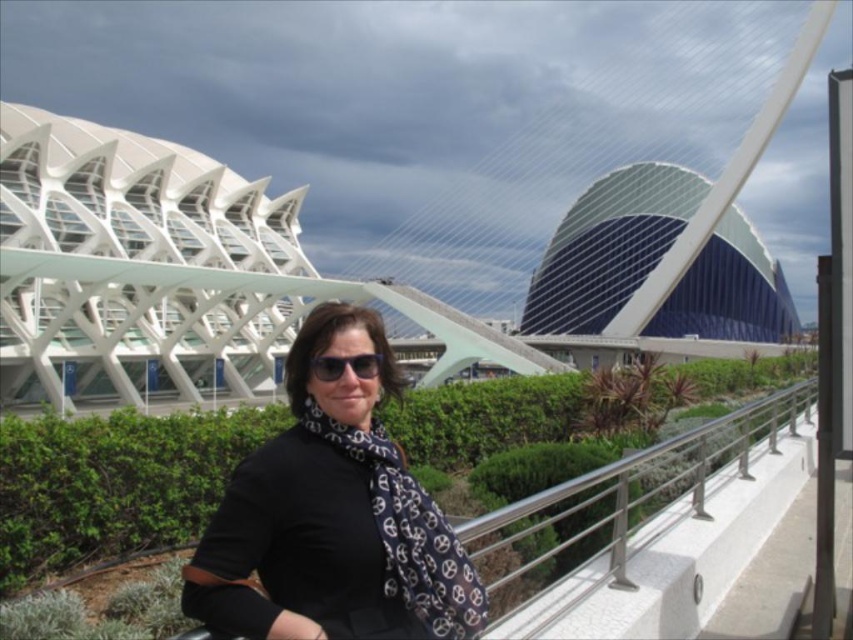
You are a visitor at this architectural site and want to pick up the black silk scarf at center. Which direction should you move relative to the metallic silver railing at center?

The black silk scarf at center is to the left of the metallic silver railing at center, so you should move to the left side of the metallic silver railing at center to pick it up.